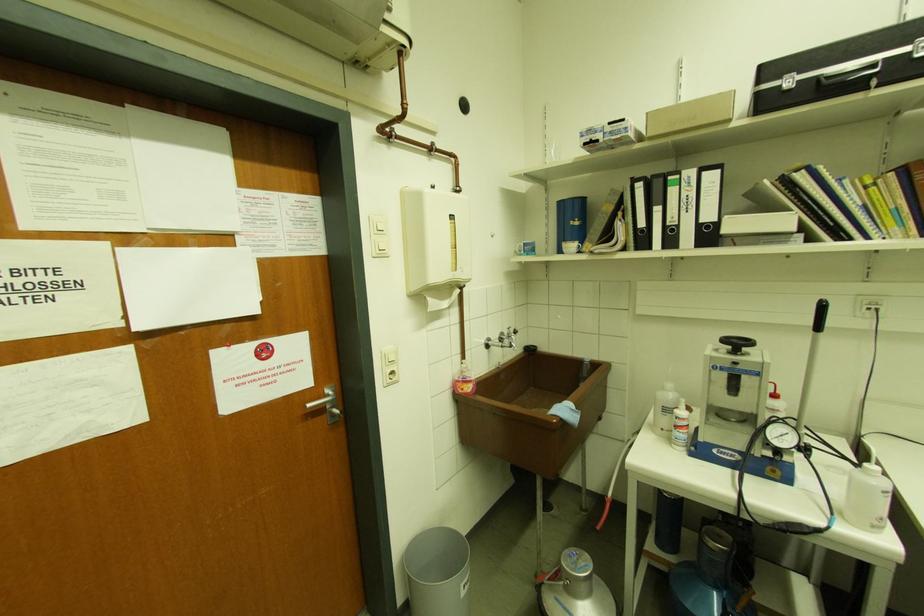
Identify the location of small white mug. This screenshot has width=924, height=616. (569, 246).